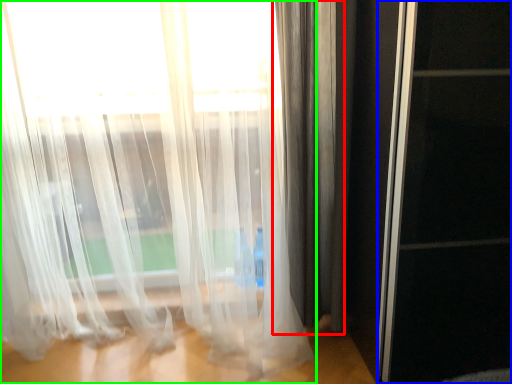
Question: Estimate the real-world distances between objects in this image. Which object is farther from curtain (highlighted by a red box), screen door (highlighted by a blue box) or curtain (highlighted by a green box)?

Choices:
 (A) screen door
 (B) curtain

Answer: (A)